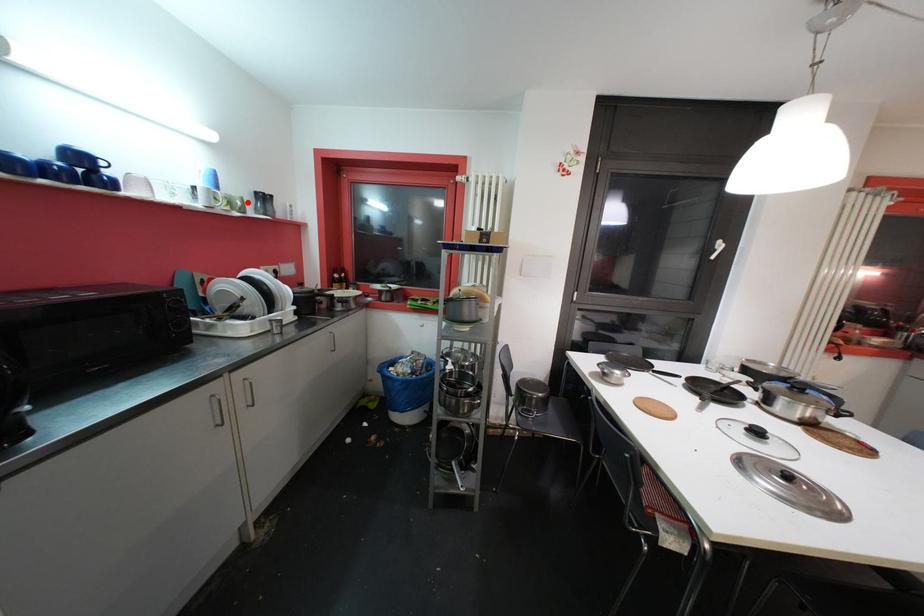
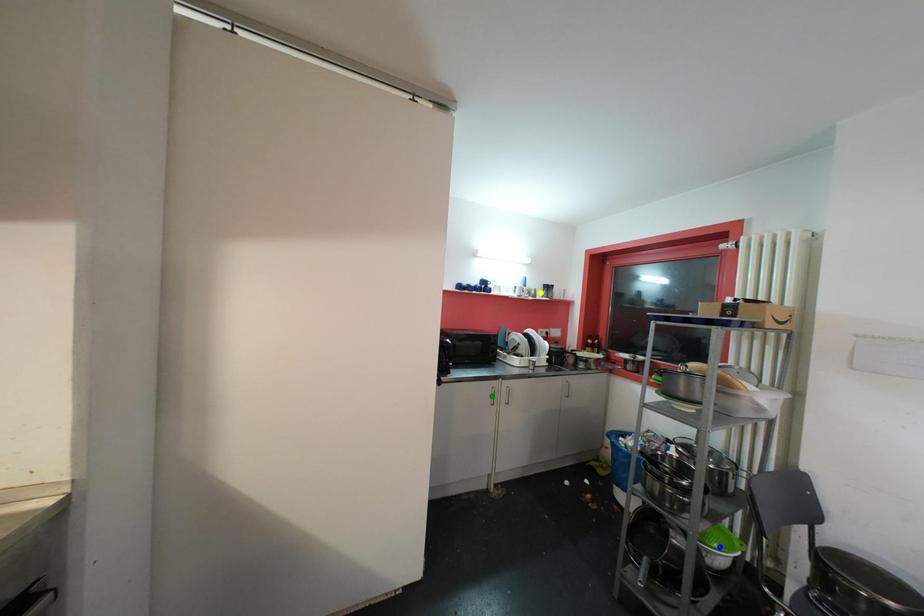
Question: I am providing you with two images of the same scene from different viewpoints. A red point is marked on the first image. You are given multiple points on the second image. Which point in image 2 is actually the same real-world point as the red point in image 1?

Choices:
 (A) yellow point
 (B) blue point
 (C) green point

Answer: (A)